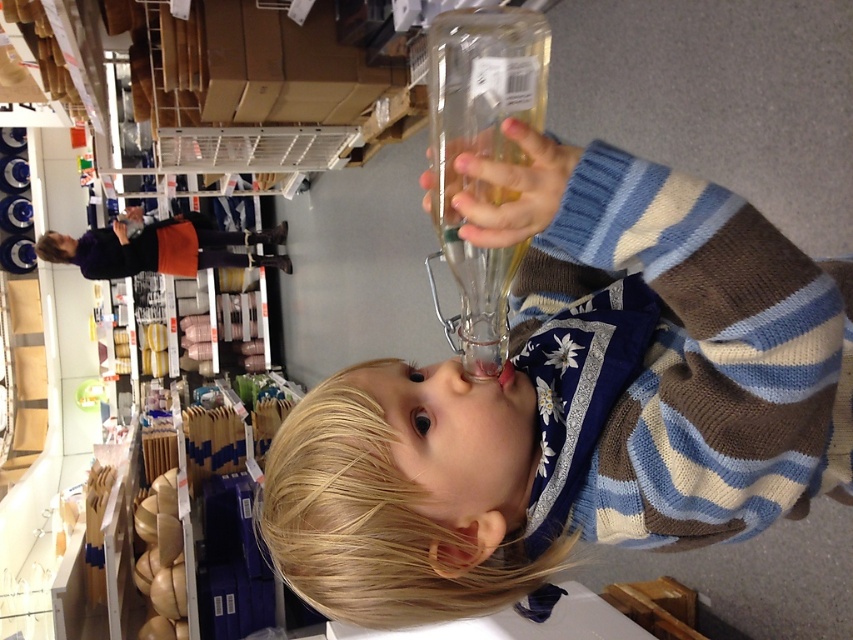
Question: Can you confirm if clear glass bottle at center is bigger than matte purple sweater at upper left?

Choices:
 (A) no
 (B) yes

Answer: (A)

Question: Is clear glass bottle at center below matte purple sweater at upper left?

Choices:
 (A) yes
 (B) no

Answer: (A)

Question: Can you confirm if clear glass bottle at center is positioned above matte purple sweater at upper left?

Choices:
 (A) no
 (B) yes

Answer: (A)